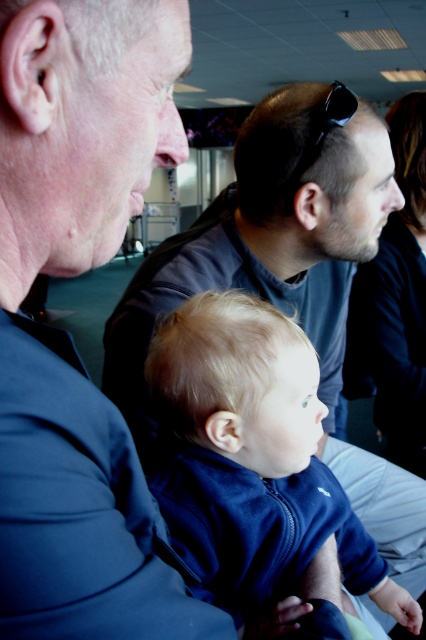
Question: Among these objects, which one is farthest from the camera?

Choices:
 (A) black plastic sunglasses at upper center
 (B) blue fleece jacket at center

Answer: (A)

Question: Does blue fleece jacket at center appear on the right side of black plastic sunglasses at upper center?

Choices:
 (A) no
 (B) yes

Answer: (A)

Question: Which point appears farthest from the camera in this image?

Choices:
 (A) (x=339, y=92)
 (B) (x=271, y=509)

Answer: (A)

Question: Observing the image, what is the correct spatial positioning of blue fleece jacket at center in reference to black plastic sunglasses at upper center?

Choices:
 (A) left
 (B) right

Answer: (A)

Question: Does blue fleece jacket at center appear on the left side of black plastic sunglasses at upper center?

Choices:
 (A) yes
 (B) no

Answer: (A)